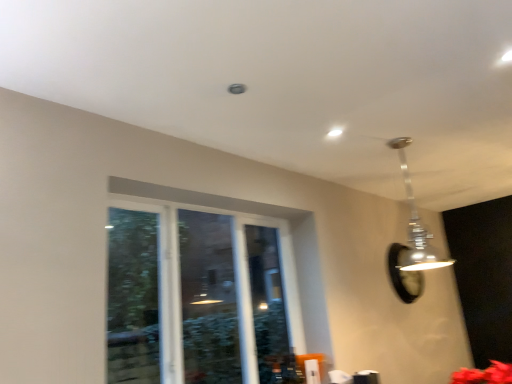
Question: Is clear glass window at center outside of black glass mirror at upper right?

Choices:
 (A) no
 (B) yes

Answer: (B)

Question: Is clear glass window at center taller than black glass mirror at upper right?

Choices:
 (A) no
 (B) yes

Answer: (B)

Question: Can you confirm if clear glass window at center is positioned to the right of black glass mirror at upper right?

Choices:
 (A) no
 (B) yes

Answer: (A)

Question: Is the position of clear glass window at center less distant than that of black glass mirror at upper right?

Choices:
 (A) yes
 (B) no

Answer: (A)

Question: Is black glass mirror at upper right completely or partially inside clear glass window at center?

Choices:
 (A) no
 (B) yes

Answer: (A)

Question: Is black glass mirror at upper right in front of or behind clear glass window at center in the image?

Choices:
 (A) behind
 (B) front

Answer: (A)

Question: Is black glass mirror at upper right inside or outside of clear glass window at center?

Choices:
 (A) inside
 (B) outside

Answer: (B)

Question: Looking at the image, does black glass mirror at upper right seem bigger or smaller compared to clear glass window at center?

Choices:
 (A) big
 (B) small

Answer: (B)

Question: Considering the positions of point (394, 269) and point (309, 339), is point (394, 269) closer or farther from the camera than point (309, 339)?

Choices:
 (A) closer
 (B) farther

Answer: (B)

Question: Considering the positions of point (434, 254) and point (407, 274), is point (434, 254) closer or farther from the camera than point (407, 274)?

Choices:
 (A) closer
 (B) farther

Answer: (B)

Question: In the image, is metallic silver pendant light at upper right on the left side or the right side of black glass mirror at upper right?

Choices:
 (A) right
 (B) left

Answer: (B)

Question: From the image's perspective, is metallic silver pendant light at upper right located above or below black glass mirror at upper right?

Choices:
 (A) above
 (B) below

Answer: (A)

Question: In terms of size, does metallic silver pendant light at upper right appear bigger or smaller than black glass mirror at upper right?

Choices:
 (A) small
 (B) big

Answer: (B)

Question: From the image's perspective, relative to metallic silver pendant light at upper right, is clear glass window at center above or below?

Choices:
 (A) above
 (B) below

Answer: (B)

Question: In terms of size, does clear glass window at center appear bigger or smaller than metallic silver pendant light at upper right?

Choices:
 (A) small
 (B) big

Answer: (B)